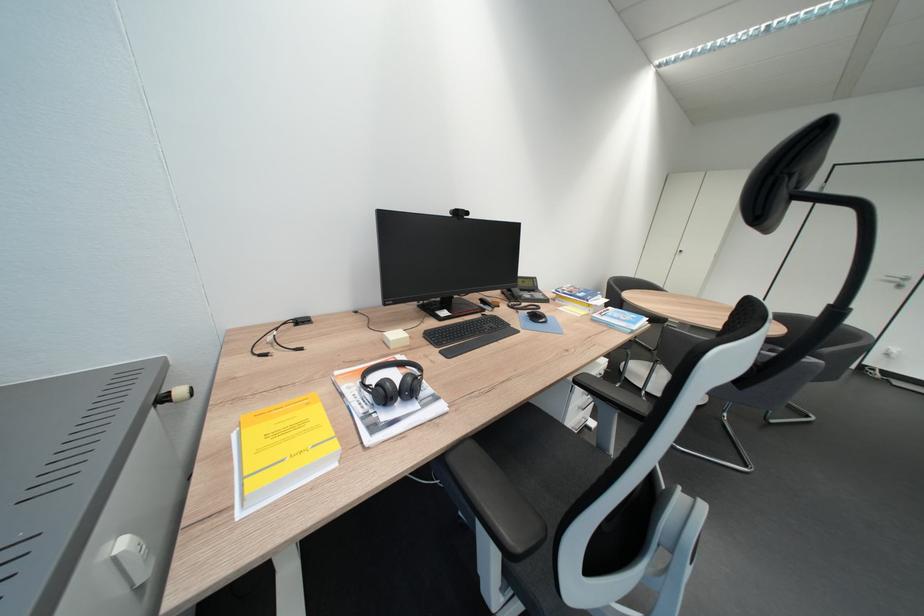
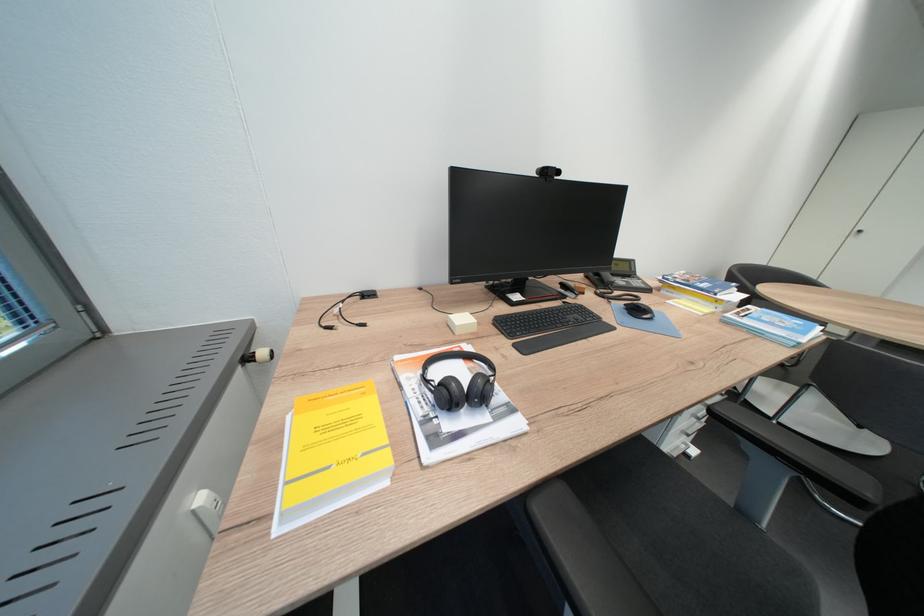
In the second image, find the point that corresponds to pixel 393 392 in the first image.

(456, 392)